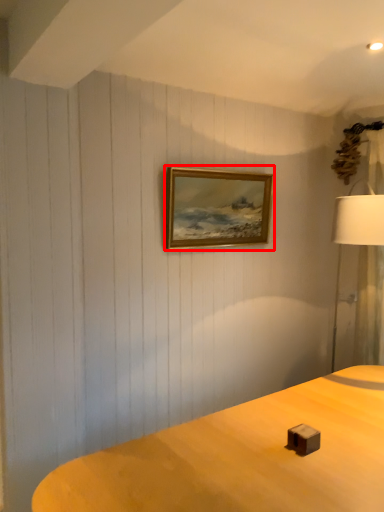
Question: Considering the relative positions of picture frame (annotated by the red box) and lamp in the image provided, where is picture frame (annotated by the red box) located with respect to the staircase?

Choices:
 (A) right
 (B) left

Answer: (B)